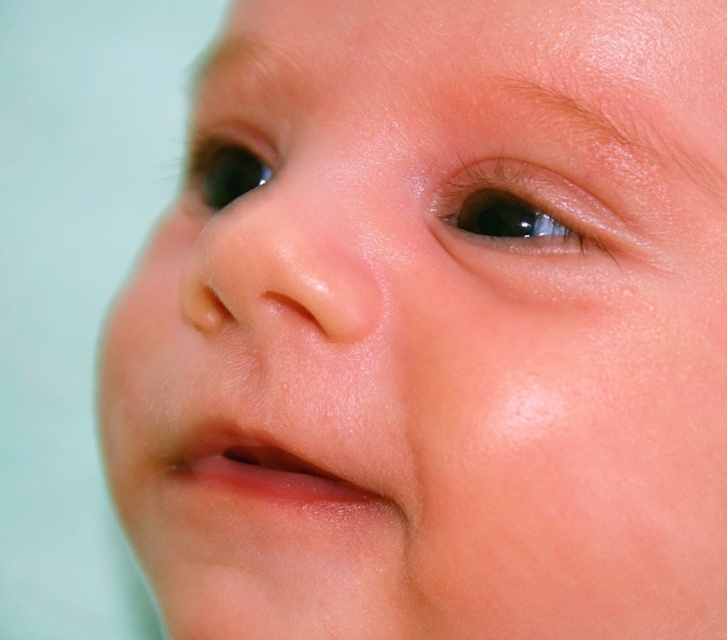
Question: Does glossy brown eye at upper center have a greater width compared to black glossy eye at upper left?

Choices:
 (A) no
 (B) yes

Answer: (B)

Question: Does glossy brown eye at upper center appear over black glossy eye at upper left?

Choices:
 (A) yes
 (B) no

Answer: (B)

Question: Can you confirm if glossy brown eye at upper center is smaller than black glossy eye at upper left?

Choices:
 (A) no
 (B) yes

Answer: (B)

Question: Which point is farther to the camera?

Choices:
 (A) black glossy eye at upper left
 (B) glossy brown eye at upper center

Answer: (A)

Question: Which point is closer to the camera taking this photo?

Choices:
 (A) (270, 164)
 (B) (502, 179)

Answer: (B)